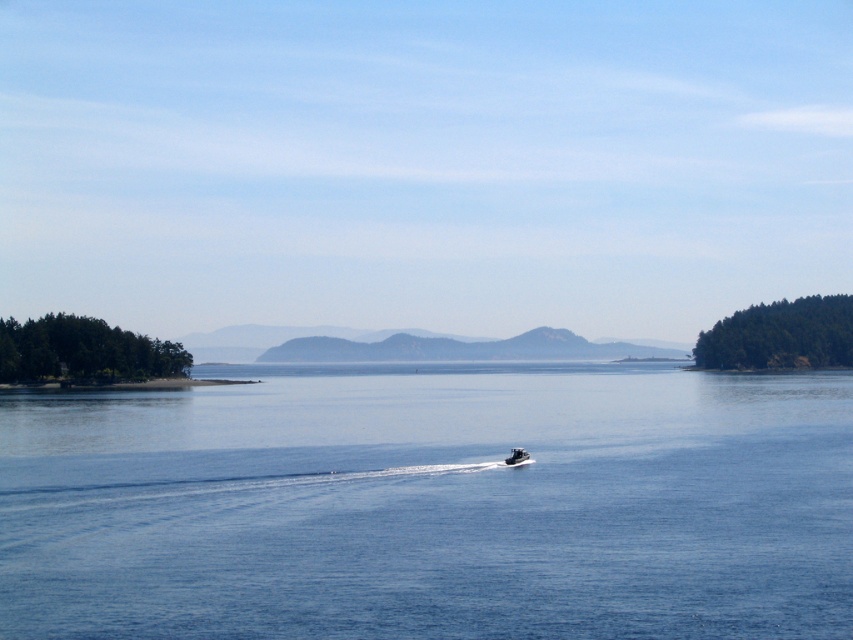
Can you confirm if blue water at center is positioned to the right of black plastic boat at center?

Incorrect, blue water at center is not on the right side of black plastic boat at center.

Is blue water at center to the left of black plastic boat at center from the viewer's perspective?

Correct, you'll find blue water at center to the left of black plastic boat at center.

What do you see at coordinates (432, 506) in the screenshot? The width and height of the screenshot is (853, 640). I see `blue water at center` at bounding box center [432, 506].

Locate an element on the screen. The width and height of the screenshot is (853, 640). blue water at center is located at coordinates (432, 506).